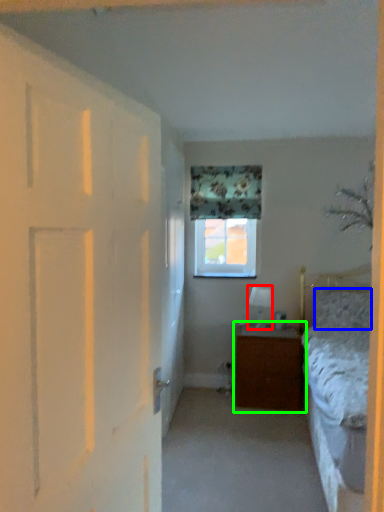
Question: Which object is the farthest from lamp (highlighted by a red box)? Choose among these: pillow (highlighted by a blue box) or nightstand (highlighted by a green box).

Choices:
 (A) pillow
 (B) nightstand

Answer: (A)